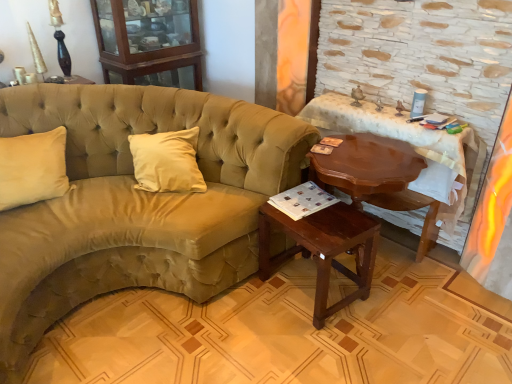
Question: Considering the relative sizes of mahogany wood side table at lower center, which is counted as the 2th table, starting from the right, and wooden cabinet at upper left in the image provided, is mahogany wood side table at lower center, which is counted as the 2th table, starting from the right, wider than wooden cabinet at upper left?

Choices:
 (A) no
 (B) yes

Answer: (A)

Question: Considering the relative sizes of mahogany wood side table at lower center, the first table in the left-to-right sequence, and wooden cabinet at upper left in the image provided, is mahogany wood side table at lower center, the first table in the left-to-right sequence, taller than wooden cabinet at upper left?

Choices:
 (A) no
 (B) yes

Answer: (A)

Question: From a real-world perspective, is mahogany wood side table at lower center, the first table in the left-to-right sequence, located higher than wooden cabinet at upper left?

Choices:
 (A) no
 (B) yes

Answer: (A)

Question: Is mahogany wood side table at lower center, which is counted as the 2th table, starting from the right, aimed at wooden cabinet at upper left?

Choices:
 (A) yes
 (B) no

Answer: (B)

Question: Is mahogany wood side table at lower center, the first table in the left-to-right sequence, positioned far away from wooden cabinet at upper left?

Choices:
 (A) no
 (B) yes

Answer: (B)

Question: From the image's perspective, is mahogany wood table at right, which is the 1th table from right to left, located above or below suede-like beige couch at left?

Choices:
 (A) below
 (B) above

Answer: (B)

Question: Considering their positions, is mahogany wood table at right, the 2th table from the left, located in front of or behind suede-like beige couch at left?

Choices:
 (A) front
 (B) behind

Answer: (B)

Question: Considering the positions of mahogany wood table at right, which is the 1th table from right to left, and suede-like beige couch at left in the image, is mahogany wood table at right, which is the 1th table from right to left, bigger or smaller than suede-like beige couch at left?

Choices:
 (A) big
 (B) small

Answer: (B)

Question: Is mahogany wood table at right, which is the 1th table from right to left, situated inside suede-like beige couch at left or outside?

Choices:
 (A) outside
 (B) inside

Answer: (A)

Question: Relative to mahogany wood table at right, which is the 1th table from right to left, is wooden cabinet at upper left in front or behind?

Choices:
 (A) behind
 (B) front

Answer: (A)

Question: Is point 129,6 positioned closer to the camera than point 448,185?

Choices:
 (A) closer
 (B) farther

Answer: (B)

Question: From a real-world perspective, is wooden cabinet at upper left physically located above or below mahogany wood table at right, which is the 1th table from right to left?

Choices:
 (A) above
 (B) below

Answer: (A)

Question: Looking at their shapes, would you say wooden cabinet at upper left is wider or thinner than mahogany wood table at right, which is the 1th table from right to left?

Choices:
 (A) thin
 (B) wide

Answer: (B)

Question: Does point (176, 77) appear closer or farther from the camera than point (38, 259)?

Choices:
 (A) closer
 (B) farther

Answer: (B)

Question: Is wooden cabinet at upper left to the left or to the right of suede-like beige couch at left in the image?

Choices:
 (A) left
 (B) right

Answer: (A)